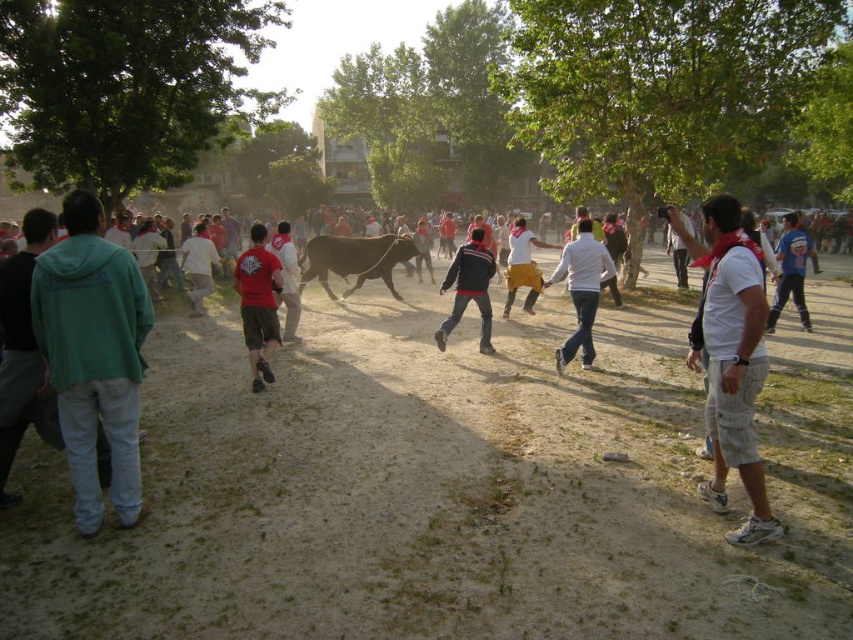
You are a photographer trying to capture a group photo of the people in the scene. You need to arrange them so that the white cotton shirt at center and the dark blue jacket at center are side by side. Based on their current positions, which one should be placed to the left to maintain their original spatial relationship?

The dark blue jacket at center should be placed to the left because the white cotton shirt at center is currently on the right side of the dark blue jacket at center.

You are a photographer trying to capture a photo of the white cotton shirt at center and the dark blue jacket at center. Based on their positions, which one should you focus on first if you want to include both in the frame without moving the camera?

The white cotton shirt at center is below the dark blue jacket at center, so you should focus on the dark blue jacket at center first to ensure both are in the frame.

You are a photographer trying to capture a clear shot of the two people in the center of the scene. The white cotton shirt at center and the dark blue jacket at center are both in your frame. Based on their heights, which one is more likely to block the view of the other?

The white cotton shirt at center is much taller than the dark blue jacket at center, so it is more likely to block the view of the dark blue jacket at center.